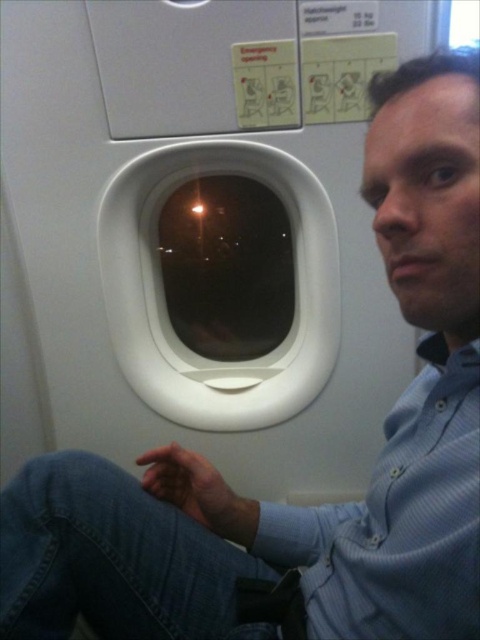
Image resolution: width=480 pixels, height=640 pixels. I want to click on blue striped shirt at right, so click(406, 518).

Can you confirm if blue striped shirt at right is shorter than transparent glass airplane window at center?

Correct, blue striped shirt at right is not as tall as transparent glass airplane window at center.

The width and height of the screenshot is (480, 640). What do you see at coordinates (406, 518) in the screenshot? I see `blue striped shirt at right` at bounding box center [406, 518].

At what (x,y) coordinates should I click in order to perform the action: click on blue striped shirt at right. Please return your answer as a coordinate pair (x, y). This screenshot has width=480, height=640. Looking at the image, I should click on (406, 518).